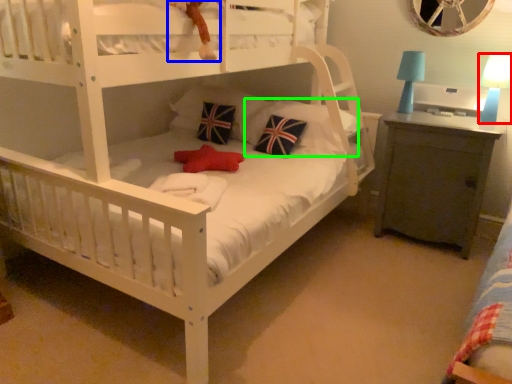
Question: Which is farther away from table lamp (highlighted by a red box)? toy (highlighted by a blue box) or pillow (highlighted by a green box)?

Choices:
 (A) toy
 (B) pillow

Answer: (A)